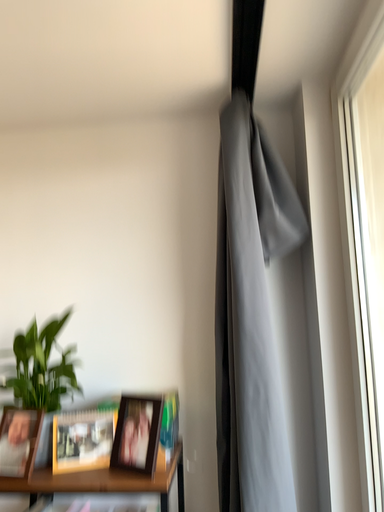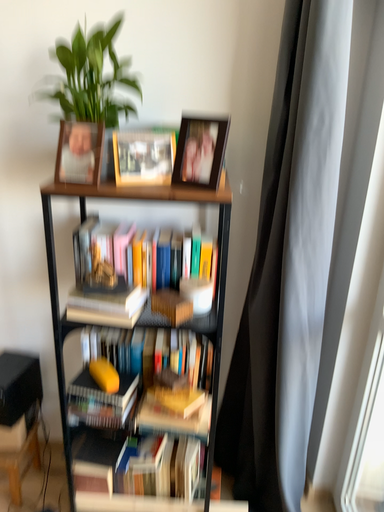
Question: How did the camera likely rotate when shooting the video?

Choices:
 (A) rotated downward
 (B) rotated upward

Answer: (A)